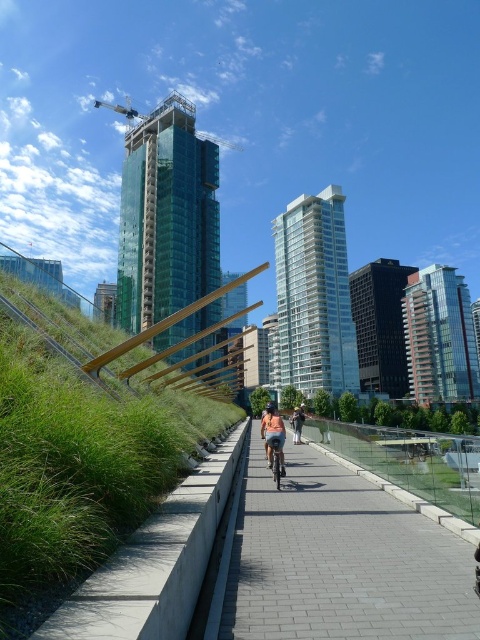
Can you confirm if green grass at center is bigger than gray brick pavement at center?

Indeed, green grass at center has a larger size compared to gray brick pavement at center.

Which of these two, green grass at center or gray brick pavement at center, stands shorter?

gray brick pavement at center is shorter.

Which is in front, point (12, 497) or point (294, 620)?

Positioned in front is point (12, 497).

Locate an element on the screen. The image size is (480, 640). green grass at center is located at coordinates (75, 454).

Between point (381, 618) and point (275, 468), which one is positioned behind?

The point (275, 468) is behind.

Measure the distance between gray brick pavement at center and camera.

The distance of gray brick pavement at center from camera is 5.18 meters.

Locate an element on the screen. gray brick pavement at center is located at coordinates (333, 560).

Is denim shorts at center to the left of metallic silver bicycle at center from the viewer's perspective?

Incorrect, denim shorts at center is not on the left side of metallic silver bicycle at center.

Is denim shorts at center behind metallic silver bicycle at center?

Yes.

Is point (280, 458) positioned before point (273, 460)?

Yes, point (280, 458) is in front of point (273, 460).

Identify the location of denim shorts at center. The height and width of the screenshot is (640, 480). (273, 435).